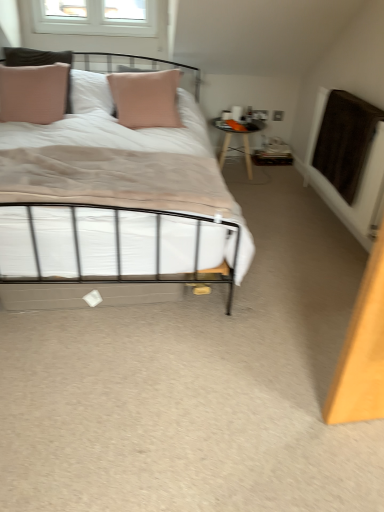
I want to click on free point in front of wooden table at right, so click(254, 193).